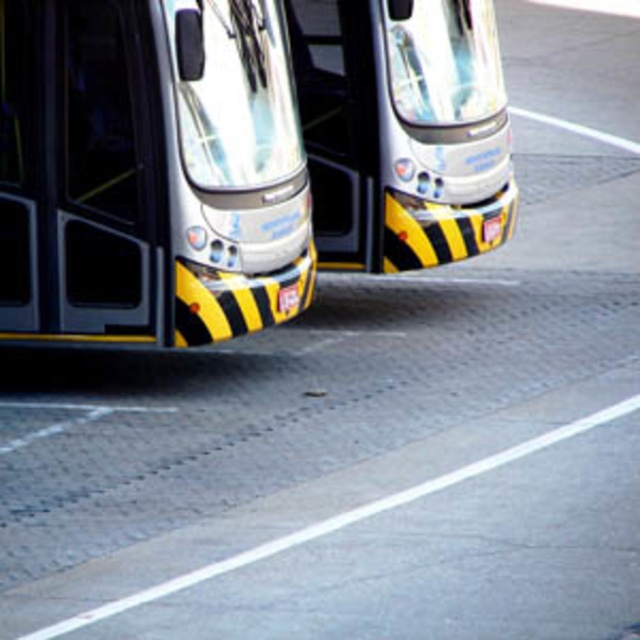
You are standing at the bus stop and notice a specific point marked at coordinates (148, 172). What does this point indicate?

The point at coordinates (148, 172) indicates the yellow and black striped bumper located at the center of the buses.

You are a pedestrian standing in front of the two buses parked side by side. You notice the yellow and black striped bumper at center and the metallic silver bus at center. Which object is nearer to you?

The yellow and black striped bumper at center is closer to the viewer than the metallic silver bus at center.